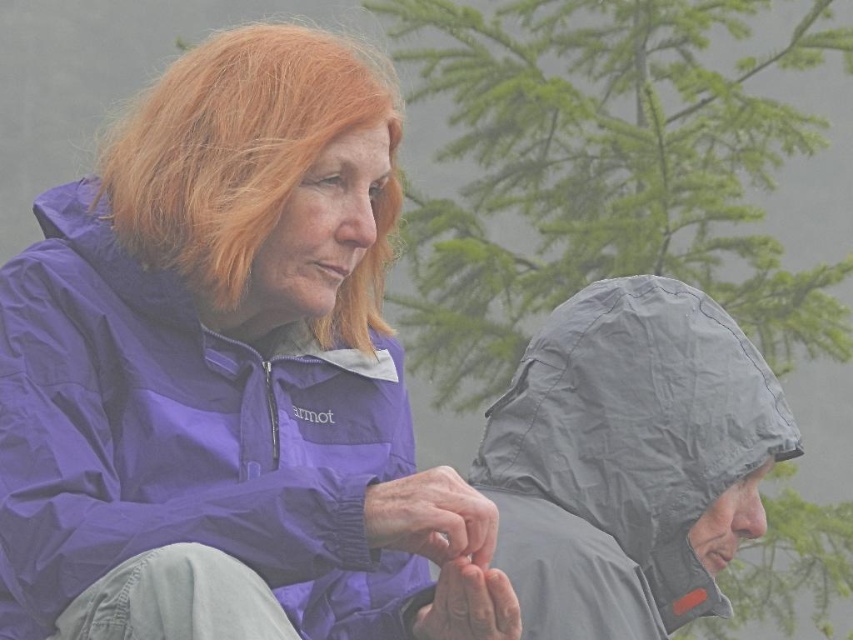
Question: Observing the image, what is the correct spatial positioning of gray waterproof hood at right in reference to blonde hair at upper left?

Choices:
 (A) below
 (B) above

Answer: (A)

Question: Which object appears closest to the camera in this image?

Choices:
 (A) gray waterproof hood at right
 (B) purple waterproof jacket at upper left
 (C) blonde hair at upper left

Answer: (B)

Question: Is purple waterproof jacket at upper left bigger than gray waterproof hood at right?

Choices:
 (A) yes
 (B) no

Answer: (A)

Question: Does purple waterproof jacket at upper left appear over blonde hair at upper left?

Choices:
 (A) no
 (B) yes

Answer: (A)

Question: Estimate the real-world distances between objects in this image. Which object is farther from the purple waterproof jacket at upper left?

Choices:
 (A) gray waterproof hood at right
 (B) blonde hair at upper left

Answer: (A)

Question: Among these points, which one is farthest from the camera?

Choices:
 (A) (630, 554)
 (B) (88, 294)

Answer: (A)